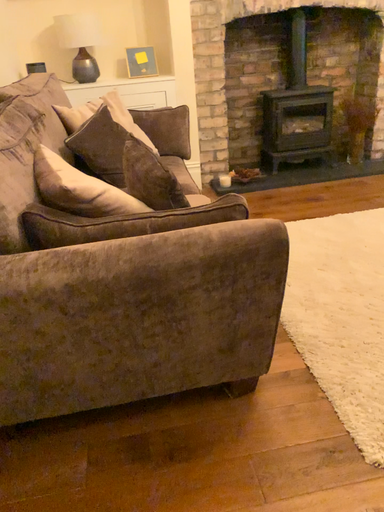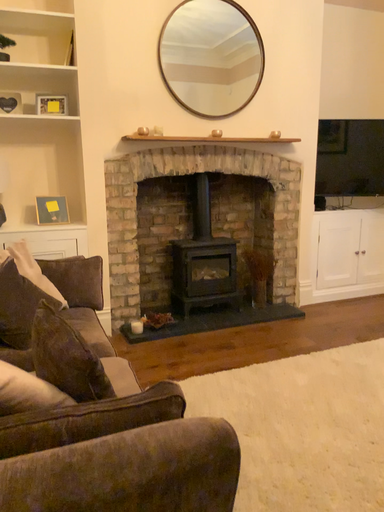
Question: How did the camera likely rotate when shooting the video?

Choices:
 (A) rotated right
 (B) rotated left

Answer: (A)